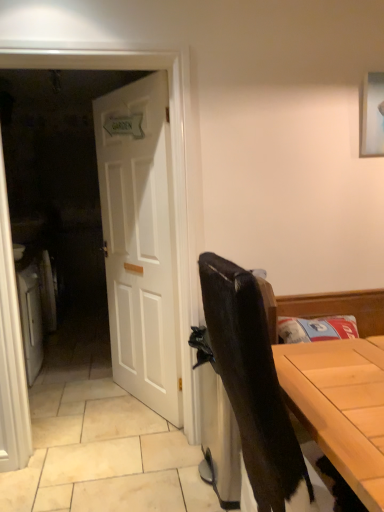
This screenshot has width=384, height=512. Identify the location of free region under white wooden door at left (from a real-world perspective). (108, 448).